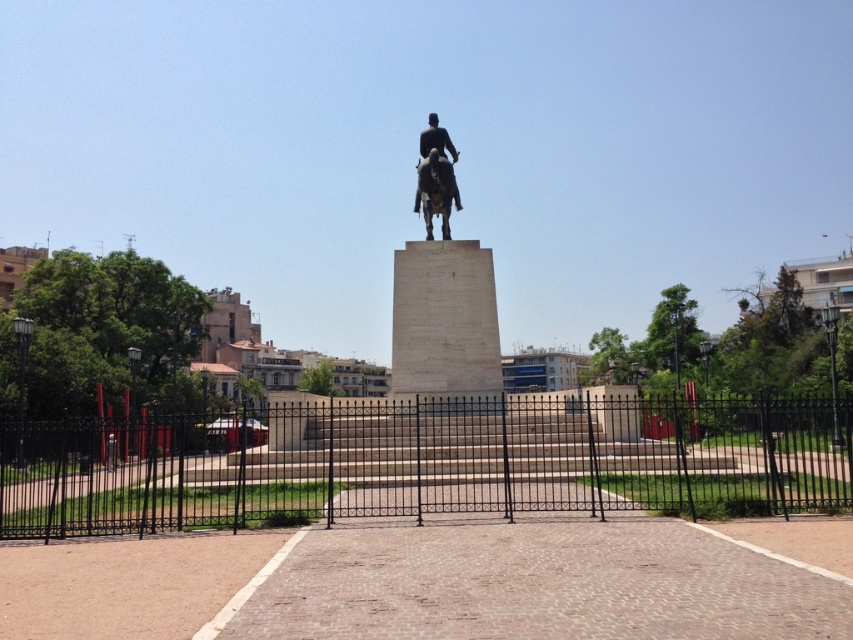
Is black wrought iron fence at center shorter than bronze statue at center?

Yes.

Does black wrought iron fence at center lie behind bronze statue at center?

No, it is not.

Is point (817, 412) positioned before point (422, 150)?

Yes, point (817, 412) is closer to viewer.

Find the location of a particular element. black wrought iron fence at center is located at coordinates (427, 461).

How far apart are bronze statue at center and black polished statue at center?

bronze statue at center and black polished statue at center are 17.38 feet apart.

The height and width of the screenshot is (640, 853). Describe the element at coordinates (444, 298) in the screenshot. I see `bronze statue at center` at that location.

Is point (450, 188) closer to camera compared to point (421, 141)?

Yes, it is.

Locate an element on the screen. bronze statue at center is located at coordinates (444, 298).

Who is more distant from viewer, (430, 218) or (425, 141)?

Point (425, 141)

Which is above, bronze metallic horse at center or black polished statue at center?

Positioned higher is black polished statue at center.

You are a GUI agent. You are given a task and a screenshot of the screen. Output one action in this format:
    pyautogui.click(x=<x>, y=<y>)
    Task: Click on the bronze metallic horse at center
    The width and height of the screenshot is (853, 640).
    Given the screenshot: What is the action you would take?
    pyautogui.click(x=434, y=192)

Where is `bronze metallic horse at center`? The image size is (853, 640). bronze metallic horse at center is located at coordinates (434, 192).